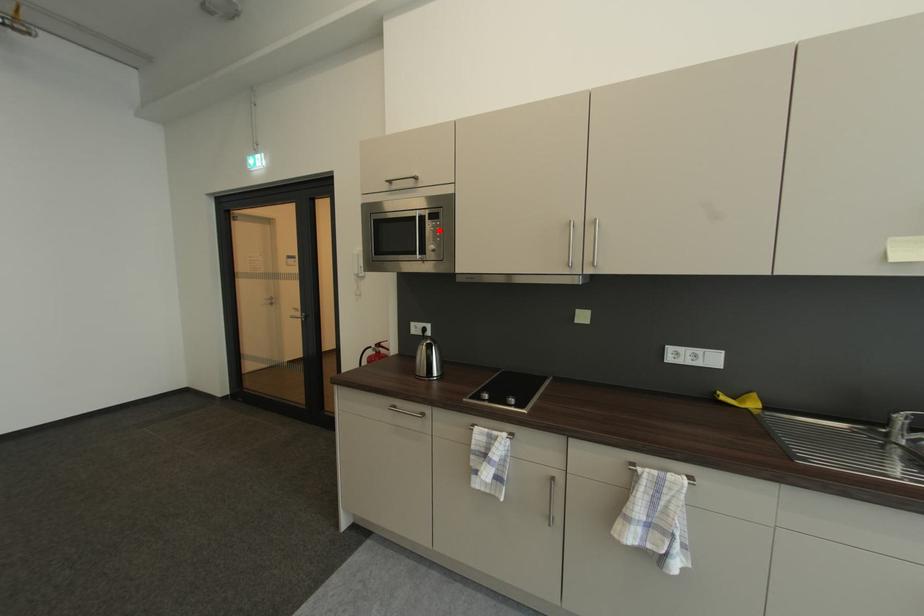
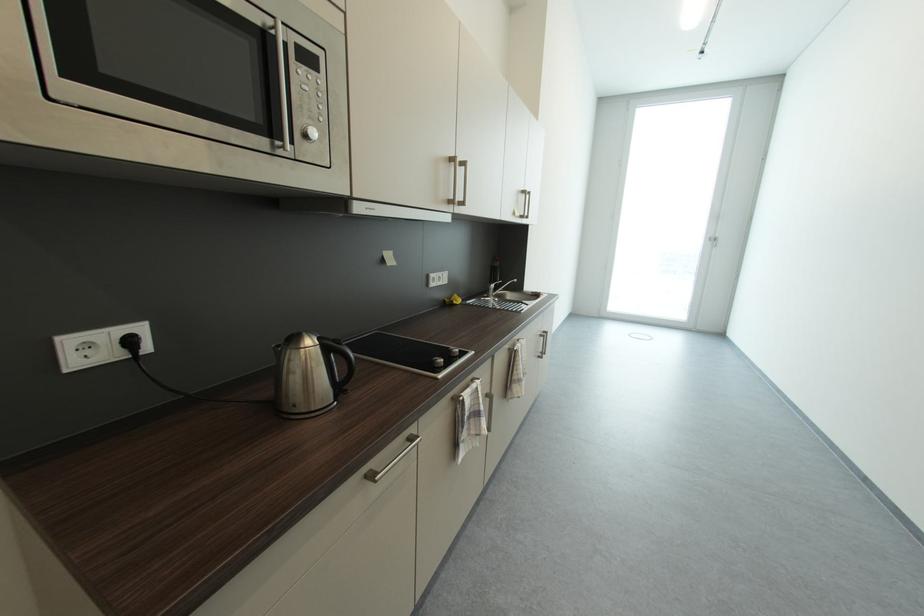
Locate, in the second image, the point that corresponds to the highlighted location in the first image.

(313, 89)